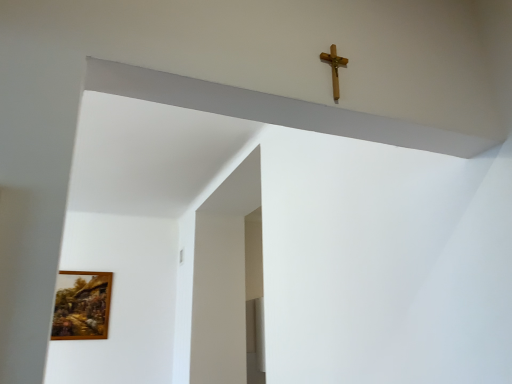
The width and height of the screenshot is (512, 384). I want to click on wooden picture frame at lower left, so click(x=82, y=307).

Describe the element at coordinates (82, 307) in the screenshot. This screenshot has width=512, height=384. I see `wooden picture frame at lower left` at that location.

The image size is (512, 384). Find the location of `wooden picture frame at lower left`. wooden picture frame at lower left is located at coordinates (82, 307).